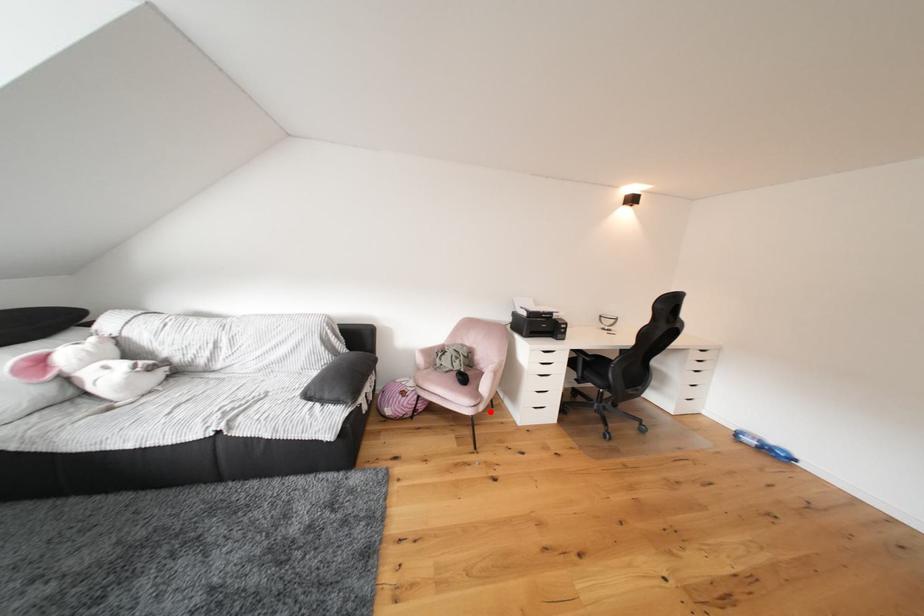
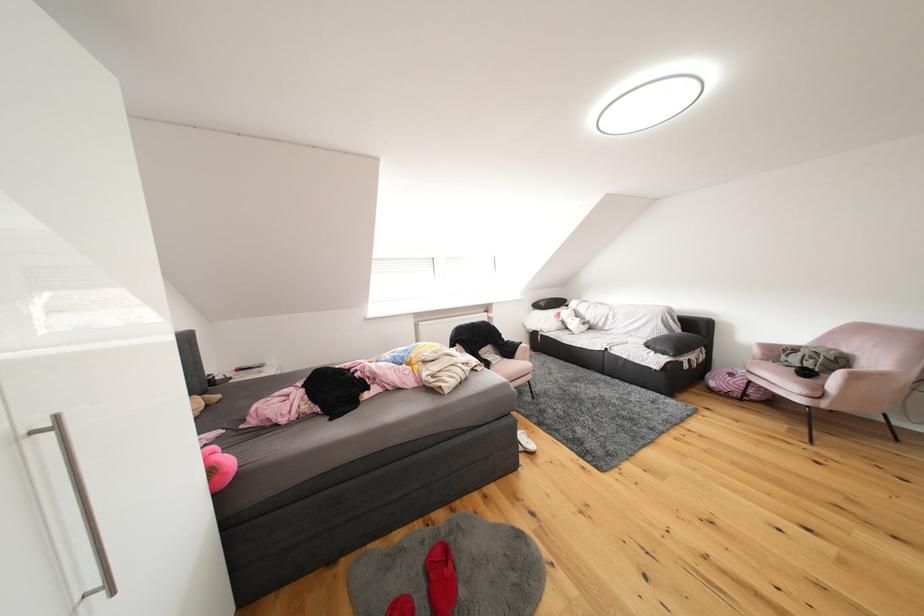
Question: I am providing you with two images of the same scene from different viewpoints. A red point is marked on the first image. Is the red point's position out of view in image 2?

Choices:
 (A) Yes
 (B) No

Answer: (B)